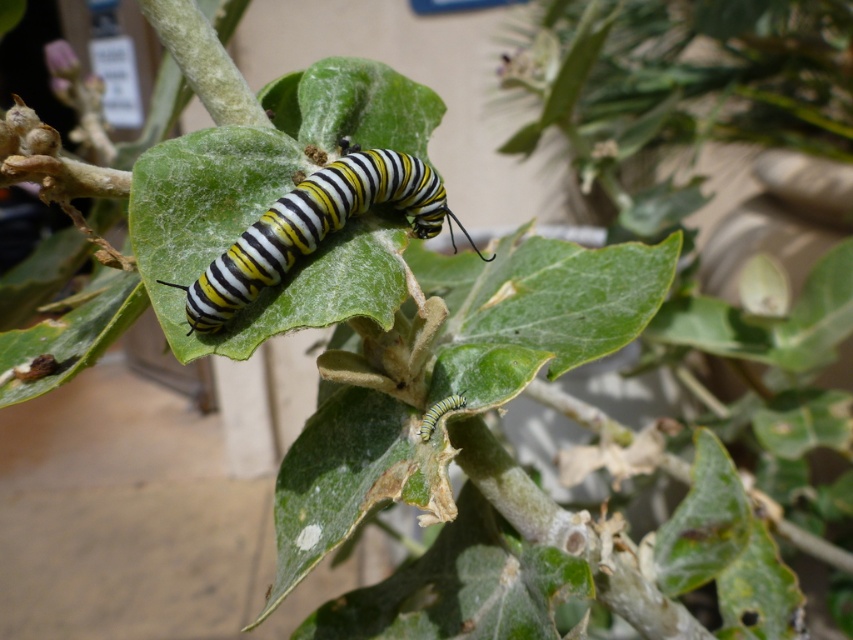
Is point (428, 200) positioned after point (451, 408)?

That is True.

Is yellow-black striped caterpillar at center thinner than yellow striped caterpillar at lower center?

In fact, yellow-black striped caterpillar at center might be wider than yellow striped caterpillar at lower center.

Between point (231, 304) and point (426, 422), which one is positioned in front?

Point (231, 304) is in front.

Where is `yellow-black striped caterpillar at center`? The width and height of the screenshot is (853, 640). yellow-black striped caterpillar at center is located at coordinates (315, 227).